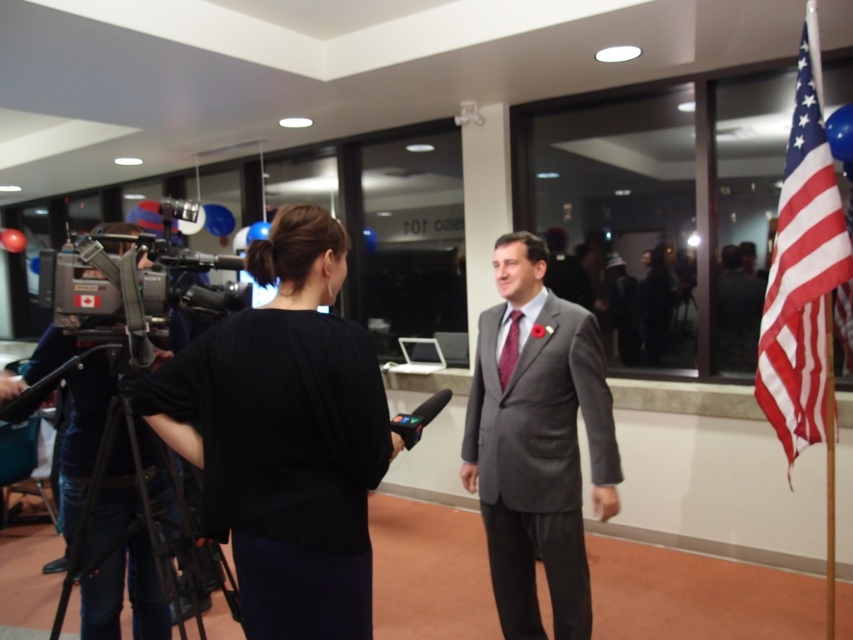
Question: Among these points, which one is farthest from the camera?

Choices:
 (A) (154, 492)
 (B) (769, 349)
 (C) (469, 492)

Answer: (C)

Question: Which of the following is the farthest from the observer?

Choices:
 (A) (138, 624)
 (B) (502, 348)

Answer: (B)

Question: Does matte gray suit at center have a lesser width compared to matte black camera at left?

Choices:
 (A) yes
 (B) no

Answer: (A)

Question: Considering the real-world distances, which object is closest to the red textured tie at center?

Choices:
 (A) matte black camera at left
 (B) matte gray suit at center

Answer: (B)

Question: Can you confirm if matte gray suit at center is positioned above matte black camera at left?

Choices:
 (A) no
 (B) yes

Answer: (B)

Question: Does black matte shirt at center appear under matte black camera at left?

Choices:
 (A) yes
 (B) no

Answer: (B)